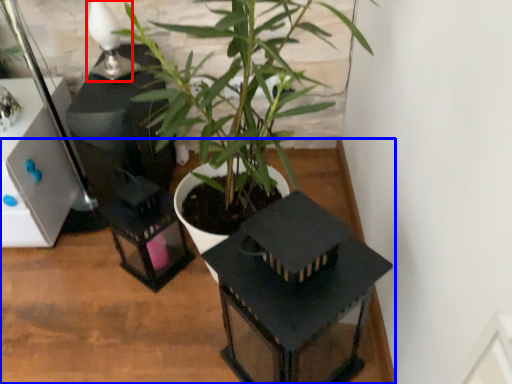
Question: Which object is further to the camera taking this photo, table lamp (highlighted by a red box) or table (highlighted by a blue box)?

Choices:
 (A) table lamp
 (B) table

Answer: (A)